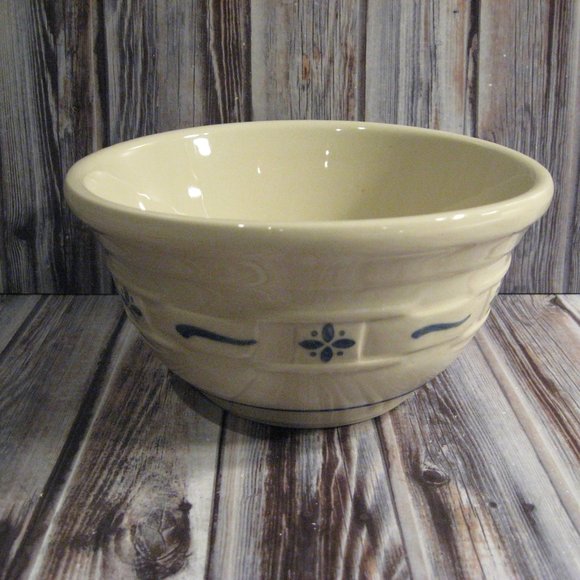
Where is `wooden wall`? This screenshot has height=580, width=580. wooden wall is located at coordinates (82, 97).